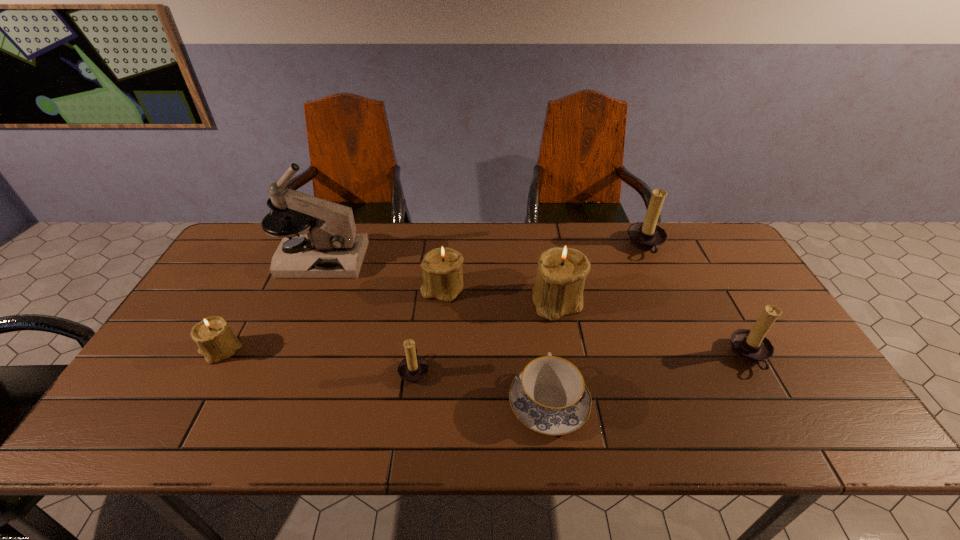
Where is `empty space between the chinaware and the rightmost object`? Image resolution: width=960 pixels, height=540 pixels. empty space between the chinaware and the rightmost object is located at coordinates (649, 380).

The height and width of the screenshot is (540, 960). In order to click on vacant area that lies between the rightmost beige candle_holder and the leftmost brown candle holder in this screenshot , I will do `click(487, 335)`.

The height and width of the screenshot is (540, 960). What are the coordinates of `free space between the rightmost brown candle holder and the blue chinaware` in the screenshot? It's located at (649, 380).

Where is `empty space that is in between the blue chinaware and the biggest brown candle holder`? empty space that is in between the blue chinaware and the biggest brown candle holder is located at coordinates (597, 324).

The width and height of the screenshot is (960, 540). Identify the location of free spot between the tallest object and the chinaware. (435, 331).

This screenshot has height=540, width=960. Identify the location of empty location between the blue chinaware and the second smallest beige candle_holder. (495, 346).

Identify the location of empty space between the smallest brown candle holder and the tallest object. (368, 315).

Where is `the third closest object relative to the fourth candle holder from left to right`? the third closest object relative to the fourth candle holder from left to right is located at coordinates (647, 236).

What are the coordinates of `object that is the second closest to the second biggest brown candle holder` in the screenshot? It's located at (558, 290).

At what (x,y) coordinates should I click in order to perform the action: click on the closest candle holder to the nearest beige candle_holder. Please return your answer as a coordinate pair (x, y). The height and width of the screenshot is (540, 960). Looking at the image, I should click on (413, 369).